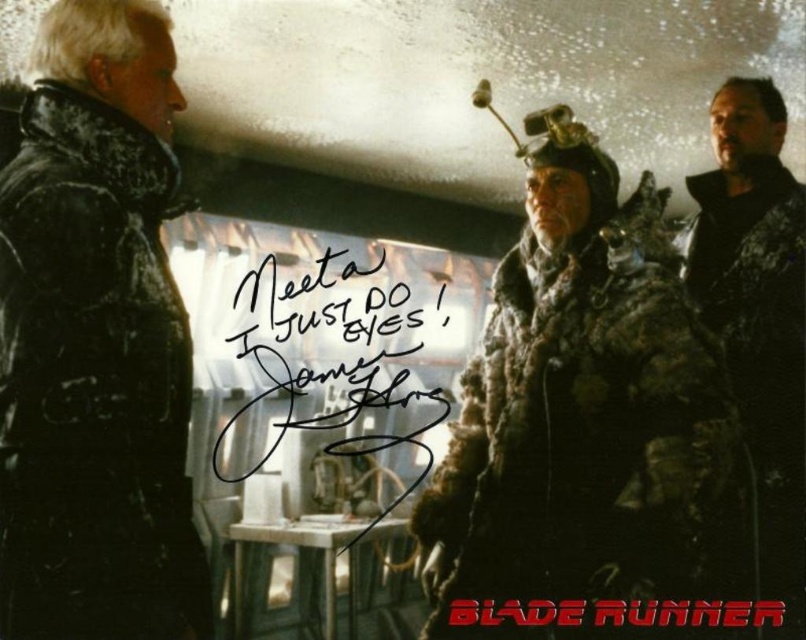
Does black textured coat at left appear under camouflage jacket at right?

No.

Is point (15, 499) farther from camera compared to point (755, 420)?

No, it is not.

Identify the location of black textured coat at left. (94, 342).

Is fuzzy fur coat at center smaller than red plastic text at center?

No.

Find the location of `fuzzy fur coat at center`. fuzzy fur coat at center is located at coordinates (578, 410).

Is black ink writing at center above red plastic text at center?

Correct, black ink writing at center is located above red plastic text at center.

Can you confirm if black ink writing at center is positioned to the right of red plastic text at center?

No, black ink writing at center is not to the right of red plastic text at center.

At what (x,y) coordinates should I click in order to perform the action: click on black ink writing at center. Please return your answer as a coordinate pair (x, y). Looking at the image, I should click on (326, 362).